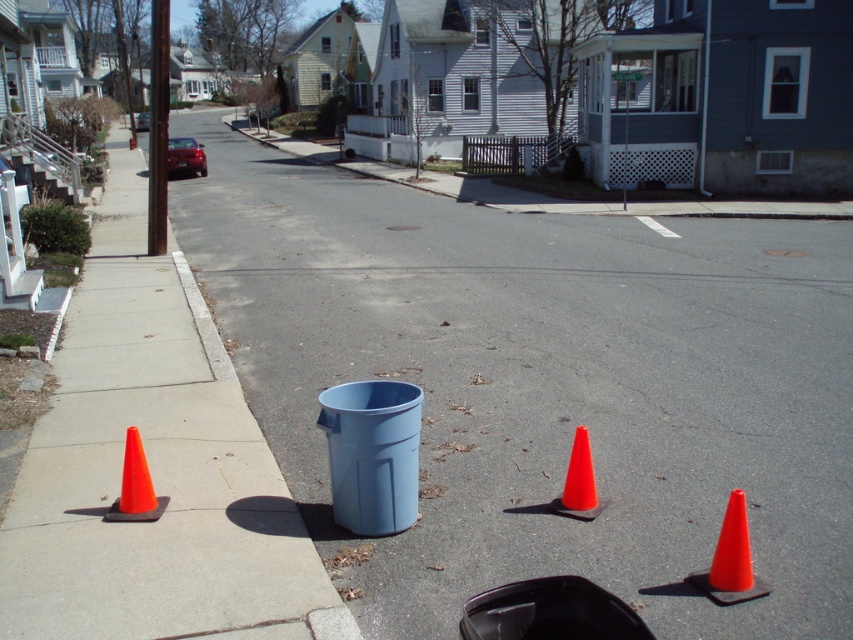
Does orange plastic cone at left have a lesser width compared to orange matte traffic cone at center?

In fact, orange plastic cone at left might be wider than orange matte traffic cone at center.

Can you confirm if orange plastic cone at left is positioned above orange matte traffic cone at center?

Yes, orange plastic cone at left is above orange matte traffic cone at center.

Measure the distance between orange plastic cone at left and camera.

orange plastic cone at left is 3.48 meters from camera.

Identify the location of orange plastic cone at left. This screenshot has height=640, width=853. (154, 467).

Does orange plastic cone at left have a larger size compared to orange matte traffic cone at lower left?

Yes.

Between point (26, 509) and point (122, 515), which one is positioned in front?

Point (122, 515) is in front.

Is point (93, 508) farther from viewer compared to point (143, 486)?

That is True.

Locate an element on the screen. The width and height of the screenshot is (853, 640). orange plastic cone at left is located at coordinates (154, 467).

Between point (221, 461) and point (712, 592), which one is positioned behind?

The point (221, 461) is behind.

Does orange plastic cone at left come in front of orange plastic traffic cone at lower right?

Yes, it is.

The image size is (853, 640). I want to click on orange plastic cone at left, so click(154, 467).